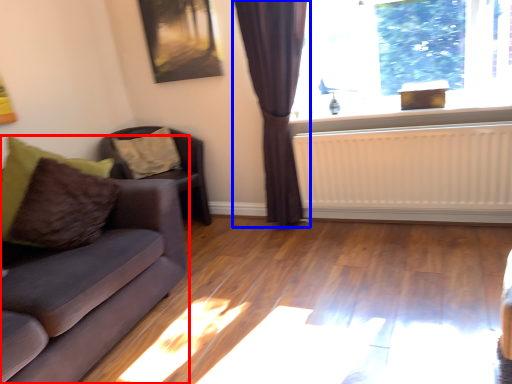
Question: Among these objects, which one is farthest to the camera, studio couch (highlighted by a red box) or curtain (highlighted by a blue box)?

Choices:
 (A) studio couch
 (B) curtain

Answer: (B)